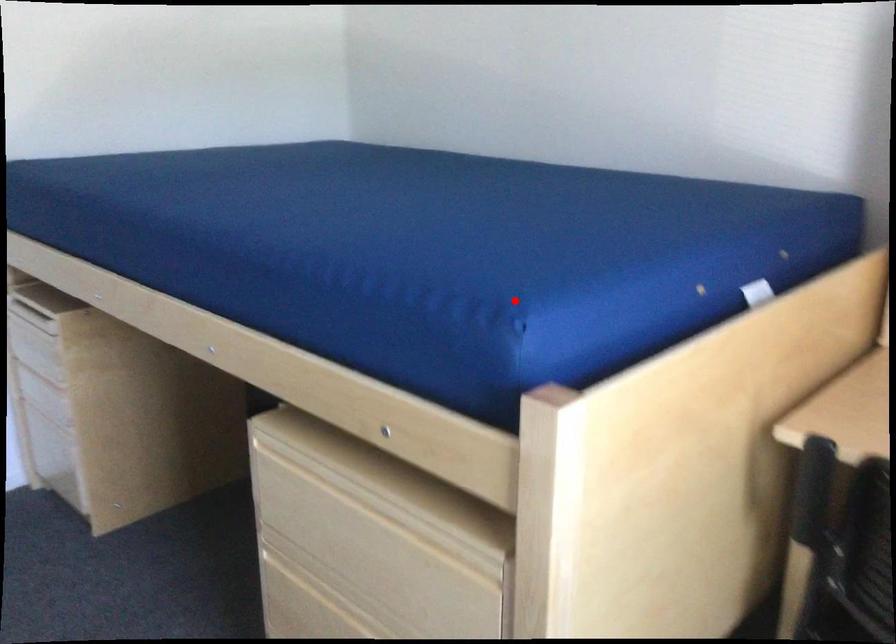
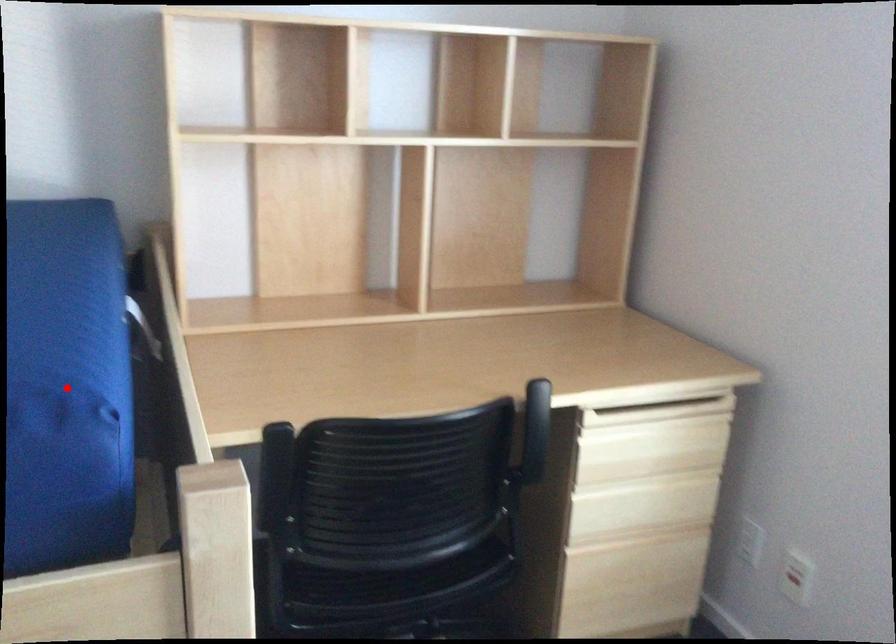
I am providing you with two images of the same scene from different viewpoints. A red point is marked on the first image and another point is marked on the second image. Is the marked point in image1 the same physical position as the marked point in image2?

Yes